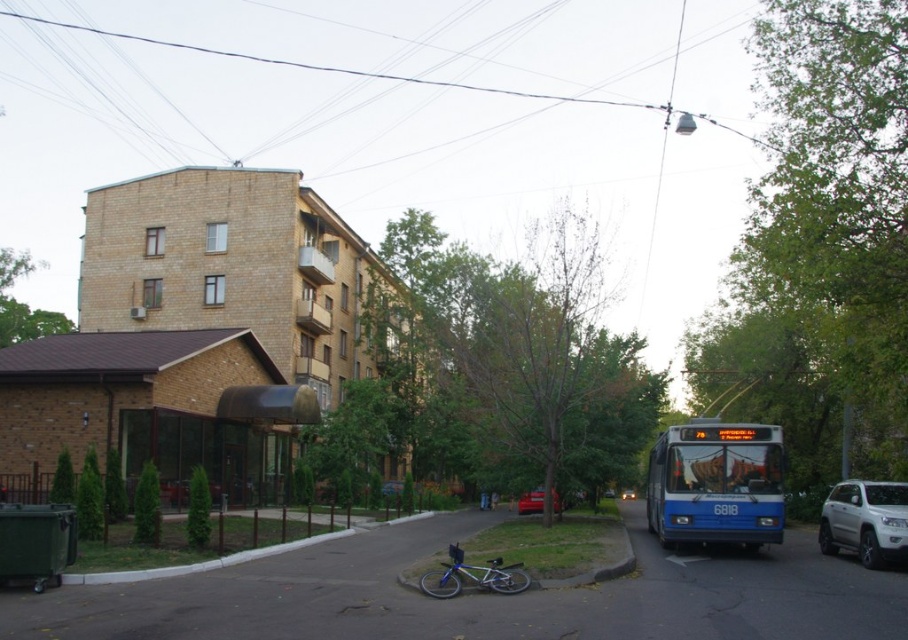
Question: Is black matte awning at center to the right of black wire at upper center from the viewer's perspective?

Choices:
 (A) no
 (B) yes

Answer: (B)

Question: Which object is farther from the camera taking this photo?

Choices:
 (A) black wire at upper center
 (B) blue metallic bus at lower right
 (C) black matte awning at center

Answer: (A)

Question: Among these points, which one is farthest from the camera?

Choices:
 (A) (887, 508)
 (B) (622, 496)
 (C) (451, 557)

Answer: (B)

Question: Which point is farther from the camera taking this photo?

Choices:
 (A) (818, 524)
 (B) (486, 561)
 (C) (633, 492)
 (D) (554, 512)

Answer: (C)

Question: Does black wire at upper center lie behind shiny silver sedan at center?

Choices:
 (A) yes
 (B) no

Answer: (A)

Question: Is black matte awning at center in front of shiny silver sedan at center?

Choices:
 (A) no
 (B) yes

Answer: (B)